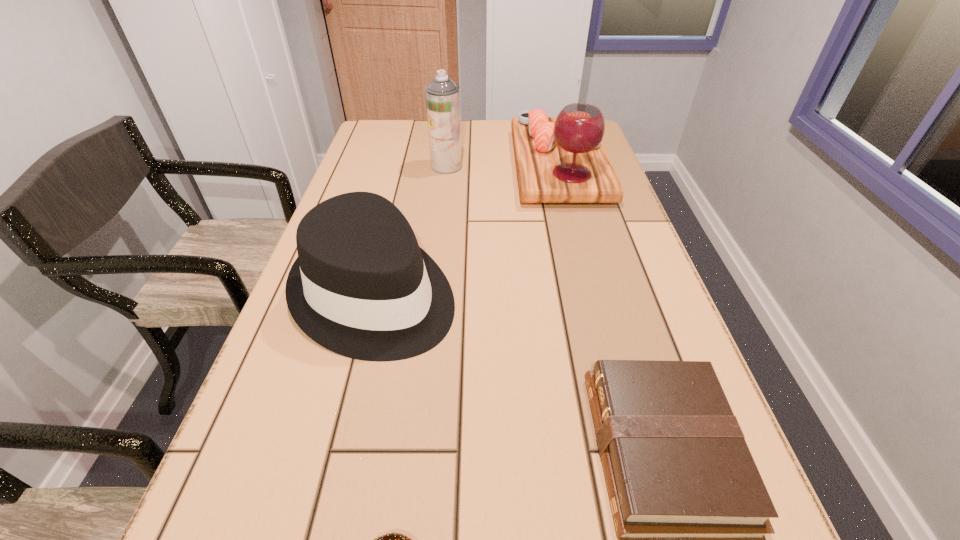
This screenshot has height=540, width=960. I want to click on the tallest object, so click(x=442, y=95).

This screenshot has height=540, width=960. Identify the location of platter. (562, 159).

You are a GUI agent. You are given a task and a screenshot of the screen. Output one action in this format:
    pyautogui.click(x=<x>, y=<y>)
    Task: Click on the third farthest object
    The width and height of the screenshot is (960, 540).
    Given the screenshot: What is the action you would take?
    pyautogui.click(x=361, y=287)

Identify the location of the third shortest object. (361, 287).

Find the location of a particular element. Image resolution: width=960 pixels, height=540 pixels. vacant region located on the front of the aerosol can is located at coordinates (444, 183).

This screenshot has width=960, height=540. I want to click on vacant space situated 0.400m on the left of the fourth shortest object, so click(380, 166).

This screenshot has height=540, width=960. I want to click on vacant point located 0.200m on the back of the third farthest object, so click(398, 198).

Locate an element on the screen. This screenshot has height=540, width=960. object that is positioned at the far edge is located at coordinates (562, 159).

Find the location of a particular element. The width and height of the screenshot is (960, 540). object present at the left edge is located at coordinates (361, 287).

I want to click on object that is at the right edge, so click(x=562, y=159).